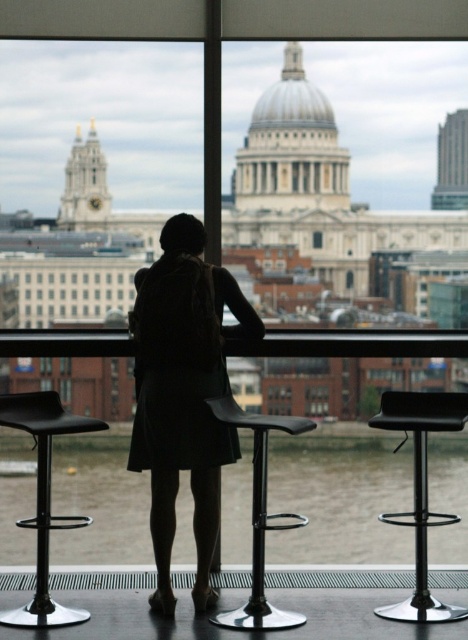
You are standing in front of the large windows in the scene. There is a point marked at coordinates (421,492). Which object does this point correspond to?

The point at coordinates (421,492) corresponds to the black leather bar stool at center.

You are a delivery person who needs to hand over a package to someone in the scene. The recipient is wearing a black fabric coat at center. Where exactly would you look to find them?

The recipient wearing the black fabric coat at center is located at point (183, 394) in the image.

You are standing in front of the large windows looking at the cityscape. There are two points marked on the window. The first point is at coordinates point [23,420] and the second is at point [231,408]. Which point is closer to you?

Point [23,420] is closer to the viewer than point [231,408].